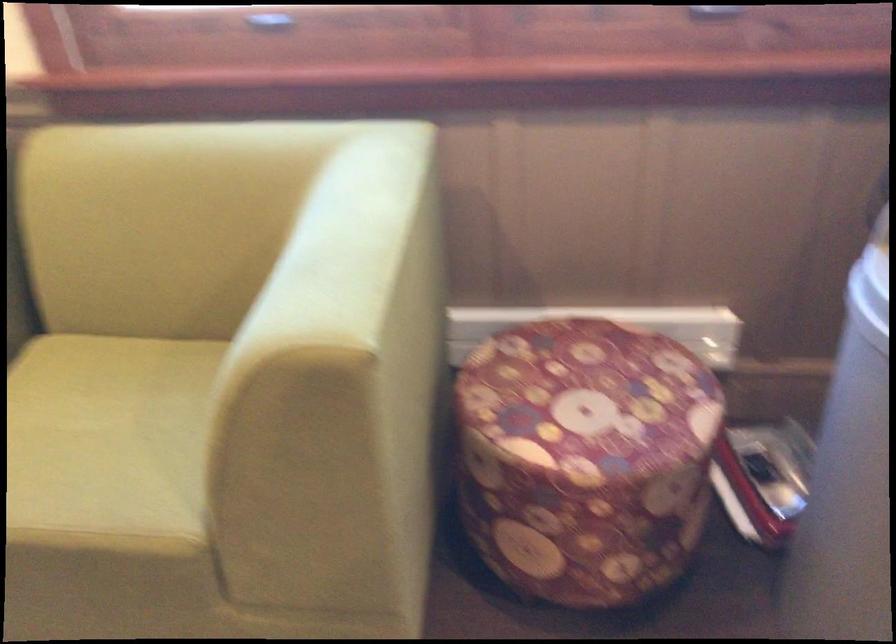
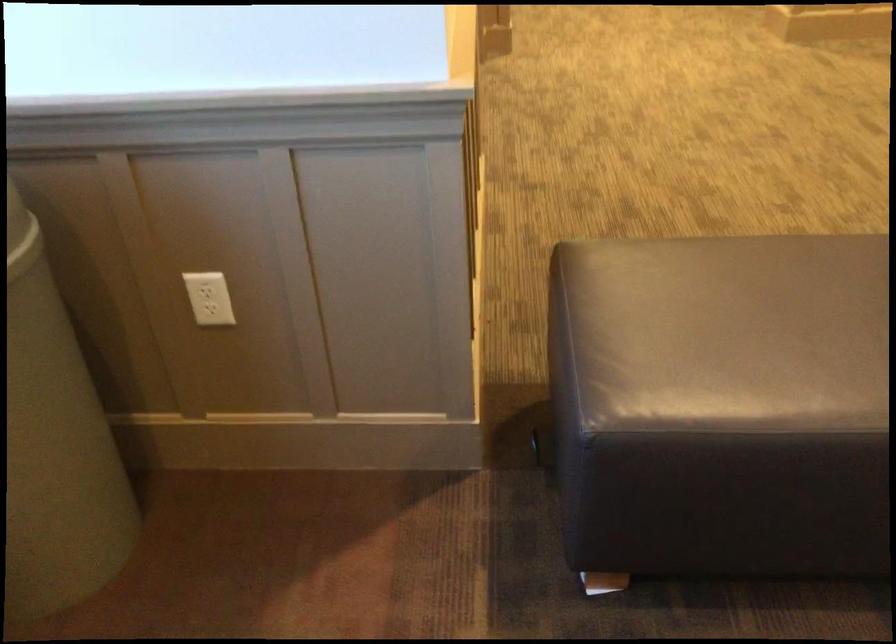
How did the camera likely rotate?

The camera rotated toward right-down.